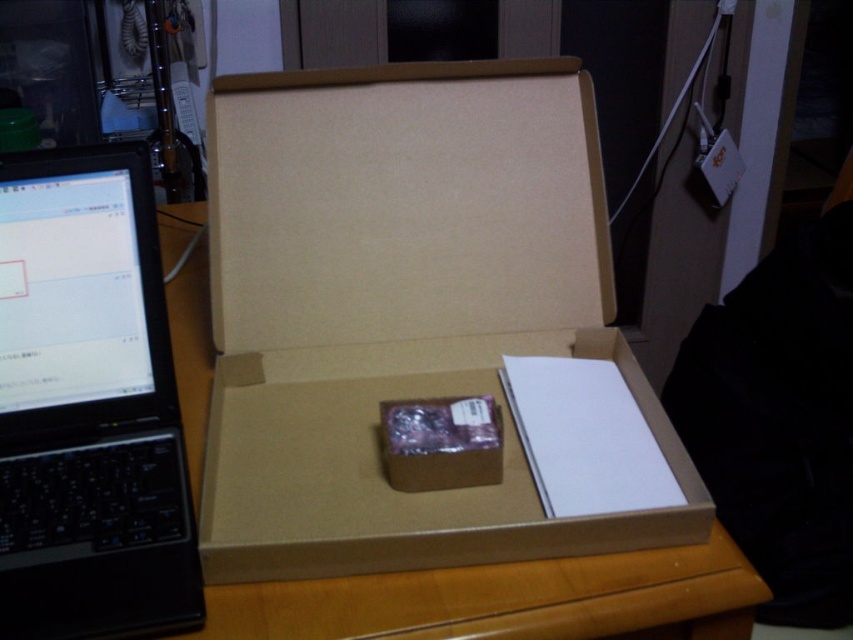
Question: Does brown cardboard box at center have a greater width compared to black plastic laptop at left?

Choices:
 (A) yes
 (B) no

Answer: (A)

Question: Which point is farther from the camera taking this photo?

Choices:
 (A) (190, 406)
 (B) (386, 145)

Answer: (B)

Question: Among these points, which one is nearest to the camera?

Choices:
 (A) (579, 241)
 (B) (430, 609)

Answer: (B)

Question: Estimate the real-world distances between objects in this image. Which object is farther from the wooden table at center?

Choices:
 (A) black plastic laptop at left
 (B) brown cardboard box at center

Answer: (B)

Question: Is brown cardboard box at center to the left of black plastic laptop at left from the viewer's perspective?

Choices:
 (A) no
 (B) yes

Answer: (A)

Question: Is brown cardboard box at center positioned at the back of black plastic laptop at left?

Choices:
 (A) yes
 (B) no

Answer: (A)